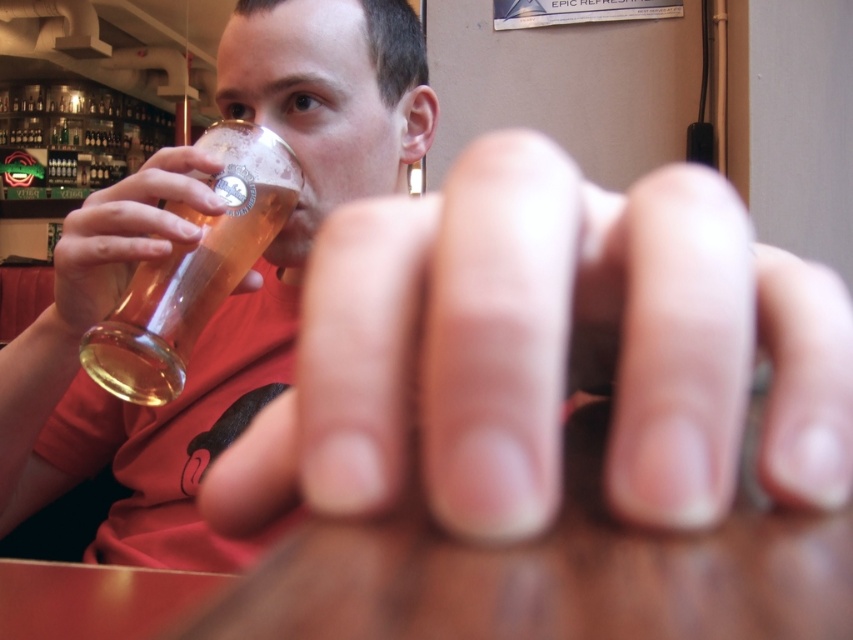
Question: Observing the image, what is the correct spatial positioning of translucent glass mug at left in reference to translucent glass beer at upper left?

Choices:
 (A) above
 (B) below

Answer: (A)

Question: Which object appears farthest from the camera in this image?

Choices:
 (A) translucent glass beer at upper left
 (B) translucent glass mug at left

Answer: (B)

Question: Is translucent glass mug at left bigger than translucent glass beer at upper left?

Choices:
 (A) no
 (B) yes

Answer: (B)

Question: Is translucent glass mug at left to the left of translucent glass beer at upper left from the viewer's perspective?

Choices:
 (A) yes
 (B) no

Answer: (B)